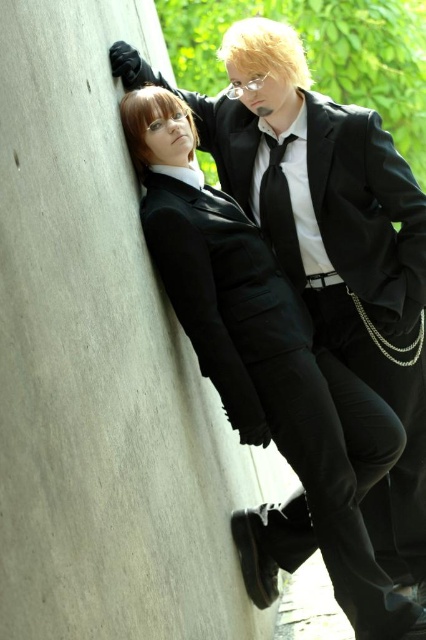
Which of these two, gray concrete wall at left or black satin tie at center, stands shorter?

With less height is gray concrete wall at left.

Which is above, gray concrete wall at left or black satin tie at center?

gray concrete wall at left is higher up.

Find the location of a particular element. This screenshot has width=426, height=640. gray concrete wall at left is located at coordinates (101, 368).

Is gray concrete wall at left wider than matte black suit at center?

No.

Does gray concrete wall at left have a lesser width compared to matte black suit at center?

Yes.

Is point (66, 92) positioned after point (233, 124)?

No, (66, 92) is in front of (233, 124).

Locate an element on the screen. The image size is (426, 640). gray concrete wall at left is located at coordinates (101, 368).

Between matte black suit at center and black satin tie at center, which one appears on the left side from the viewer's perspective?

Positioned to the left is black satin tie at center.

Is matte black suit at center above black satin tie at center?

No.

Identify the location of matte black suit at center. (336, 243).

The height and width of the screenshot is (640, 426). Find the location of `matte black suit at center`. matte black suit at center is located at coordinates (336, 243).